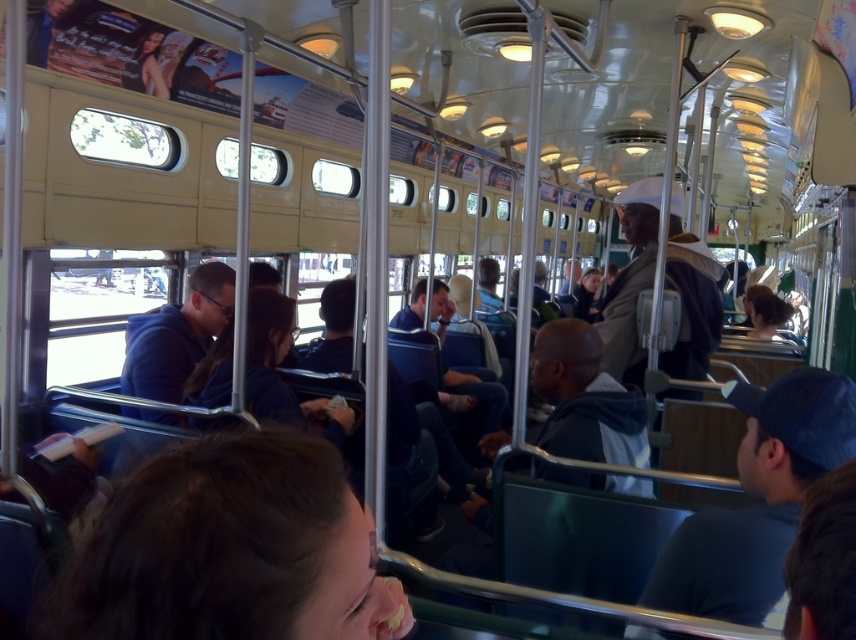
You are a passenger on the bus and you want to know if the dark brown hair at lower center is taking up more space than the blue fabric cap at right. Can you tell?

The dark brown hair at lower center occupies less space than the blue fabric cap at right, so the blue fabric cap at right is taking up more space.

You are a passenger on a crowded bus and you see the blue fabric cap at right and the brown matte hard hat at center. Which object takes up more space in the scene?

The brown matte hard hat at center takes up more space than the blue fabric cap at right.

You are a passenger on the public transit vehicle and notice two items hanging above you. The blue fabric cap at right and the brown matte hard hat at center. Which item is closer to the ceiling?

The brown matte hard hat at center is closer to the ceiling because the blue fabric cap at right is located below it.